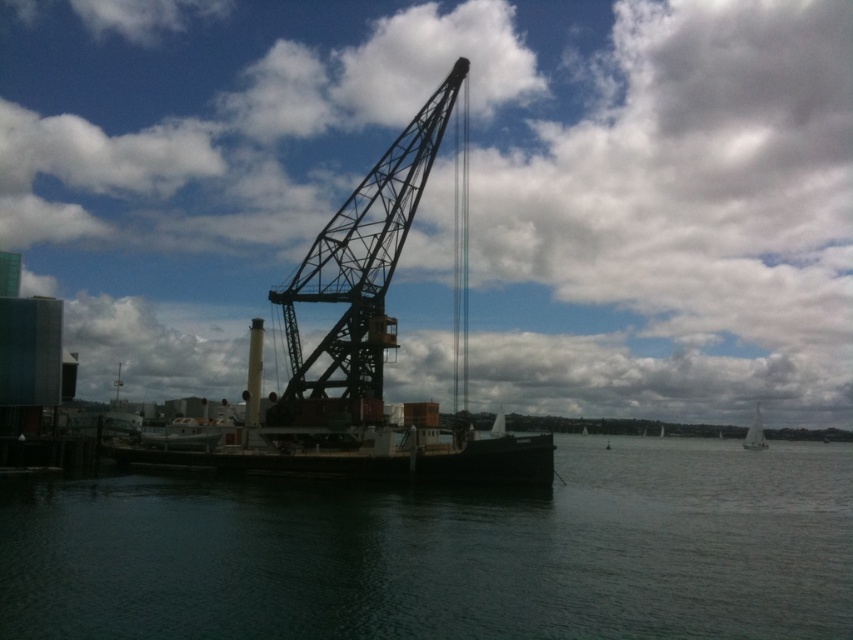
You are standing on the pier and looking at the scene. Which object, the dark matte water at center or the metallic industrial crane at center, is positioned closer to you?

The dark matte water at center is closer to the viewer than the metallic industrial crane at center.

You are a sailor trying to navigate a small boat through the area. The dark matte water at center and the metallic industrial crane at center are in your path. Which object will your boat pass under first?

The dark matte water at center is not as tall as the metallic industrial crane at center, so the boat will pass under the metallic industrial crane at center first since it is taller and must be navigated under first.

You are standing on the pier and see the point marked at coordinates [355,353]. Which object does this point lie on?

The point marked at coordinates [355,353] lies on the metallic industrial crane at center.